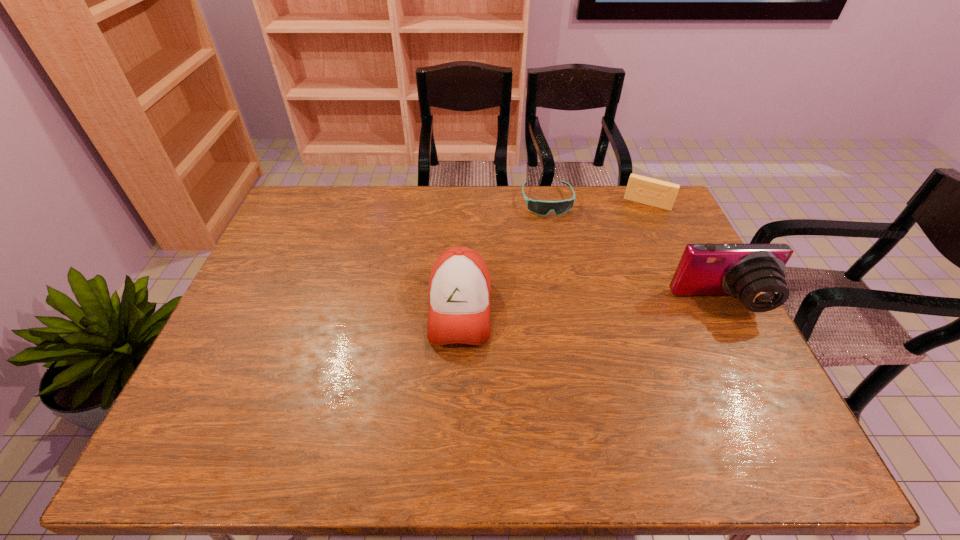
This screenshot has width=960, height=540. Identify the location of free space located on the front-facing side of the second object from left to right. (556, 239).

Locate an element on the screen. free space located 0.240m on the front-facing side of the second object from left to right is located at coordinates (563, 267).

I want to click on videotape that is at the far edge, so click(x=661, y=194).

Locate an element on the screen. Image resolution: width=960 pixels, height=540 pixels. sunglasses that is at the far edge is located at coordinates (539, 207).

Locate an element on the screen. Image resolution: width=960 pixels, height=540 pixels. camera that is at the right edge is located at coordinates click(753, 273).

The height and width of the screenshot is (540, 960). Identify the location of videotape positioned at the right edge. (661, 194).

Where is `object present at the far right corner`? This screenshot has width=960, height=540. object present at the far right corner is located at coordinates (661, 194).

The height and width of the screenshot is (540, 960). I want to click on free space at the far edge, so click(x=490, y=196).

The height and width of the screenshot is (540, 960). Identify the location of vacant region at the near edge of the desktop. (286, 390).

You are a GUI agent. You are given a task and a screenshot of the screen. Output one action in this format:
    pyautogui.click(x=<x>, y=<y>)
    Task: Click on the blank space at the right edge
    The image size is (960, 540).
    Given the screenshot: What is the action you would take?
    [706, 350]